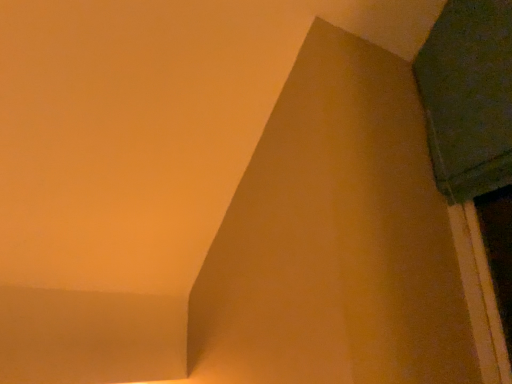
You are a GUI agent. You are given a task and a screenshot of the screen. Output one action in this format:
    pyautogui.click(x=<x>, y=<y>)
    Task: Click on the green matte window screen at upper right
    The height and width of the screenshot is (384, 512).
    Given the screenshot: What is the action you would take?
    tap(468, 97)

What do you see at coordinates (468, 97) in the screenshot?
I see `green matte window screen at upper right` at bounding box center [468, 97].

Where is `green matte window screen at upper right`? green matte window screen at upper right is located at coordinates (468, 97).